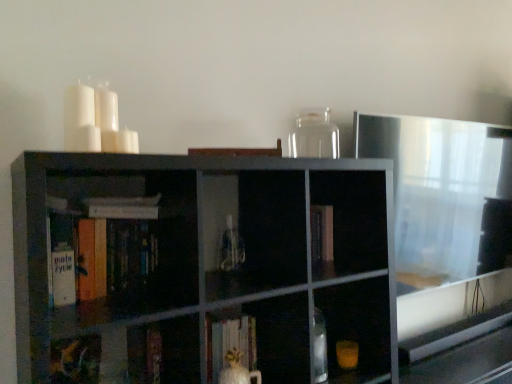
Question: In the image, is white matte book at left, placed as the 3th book when sorted from top to bottom, on the left side or the right side of hardcover book at center, which is counted as the 5th book, starting from the bottom?

Choices:
 (A) right
 (B) left

Answer: (A)

Question: Considering their positions, is white matte book at left, placed as the 3th book when sorted from top to bottom, located in front of or behind hardcover book at center, which appears as the 1th book when viewed from the top?

Choices:
 (A) front
 (B) behind

Answer: (B)

Question: Considering the real-world distances, which object is closest to the hardcover book at center, which appears as the 1th book when viewed from the top?

Choices:
 (A) white matte book at left, placed as the 3th book when sorted from top to bottom
 (B) white matte candle at upper left, which appears as the first candle when viewed from the left
 (C) white matte book at upper left, arranged as the 4th book when ordered from the bottom
 (D) white matte book at center, positioned as the fourth book in top-to-bottom order
 (E) matte black bookshelf at center

Answer: (C)

Question: Considering the real-world distances, which object is farthest from the white matte candle at upper left, which ranks as the 2th candle in left-to-right order?

Choices:
 (A) white matte candle at upper left, which appears as the first candle when viewed from the left
 (B) white matte book at left, the third book in the bottom-to-top sequence
 (C) transparent glass jar at upper center
 (D) white matte book at center, placed as the second book when sorted from bottom to top
 (E) matte black bookshelf at center

Answer: (C)